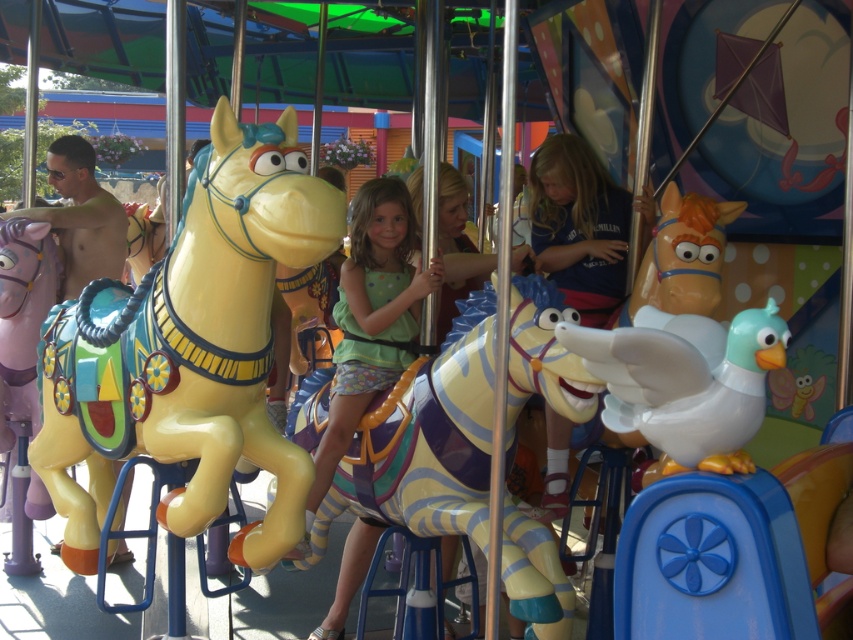
Question: Is glossy yellow horse at left positioned behind matte green dress at center?

Choices:
 (A) yes
 (B) no

Answer: (B)

Question: Which point is farther to the camera?

Choices:
 (A) (85, 268)
 (B) (323, 257)
 (C) (352, 429)

Answer: (A)

Question: Considering the real-world distances, which object is farthest from the matte green dress at center?

Choices:
 (A) shiny gold helmet at left
 (B) glossy yellow horse at left

Answer: (A)

Question: Is the position of matte green dress at center less distant than that of shiny gold helmet at left?

Choices:
 (A) no
 (B) yes

Answer: (B)

Question: Is glossy yellow horse at left wider than shiny gold helmet at left?

Choices:
 (A) no
 (B) yes

Answer: (B)

Question: Among these objects, which one is nearest to the camera?

Choices:
 (A) shiny gold helmet at left
 (B) glossy yellow horse at left

Answer: (B)